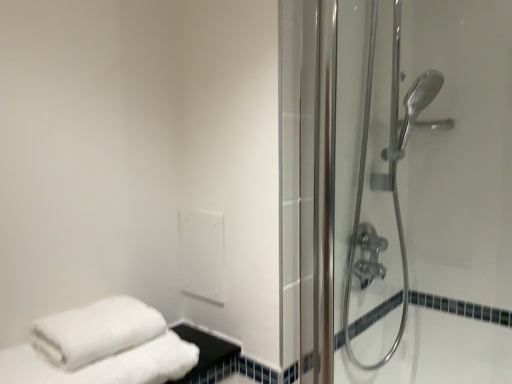
What is the approximate width of polished chrome shower door at right, positioned as the second shower door in front-to-back order?

polished chrome shower door at right, positioned as the second shower door in front-to-back order, is 7.15 inches in width.

You are a GUI agent. You are given a task and a screenshot of the screen. Output one action in this format:
    pyautogui.click(x=<x>, y=<y>)
    Task: Click on the polished chrome shower door at right, which is counted as the 1th shower door, starting from the back
    This screenshot has width=512, height=384.
    Given the screenshot: What is the action you would take?
    pyautogui.click(x=360, y=213)

This screenshot has height=384, width=512. Describe the element at coordinates (360, 213) in the screenshot. I see `polished chrome shower door at right, positioned as the second shower door in front-to-back order` at that location.

In order to face polished chrome shower door at right, positioned as the second shower door in front-to-back order, should I rotate leftwards or rightwards?

Turn right approximately 18.663 degrees to face it.

This screenshot has height=384, width=512. What are the coordinates of `transparent glass shower door at right, positioned as the 1th shower door in front-to-back order` in the screenshot? It's located at (425, 185).

Describe the element at coordinates (425, 185) in the screenshot. This screenshot has width=512, height=384. I see `transparent glass shower door at right, the 2th shower door in the back-to-front sequence` at that location.

Image resolution: width=512 pixels, height=384 pixels. I want to click on polished chrome shower door at right, which is counted as the 1th shower door, starting from the back, so click(360, 213).

Based on their positions, is transparent glass shower door at right, the 2th shower door in the back-to-front sequence, located to the left or right of polished chrome shower door at right, positioned as the second shower door in front-to-back order?

In the image, transparent glass shower door at right, the 2th shower door in the back-to-front sequence, appears on the left side of polished chrome shower door at right, positioned as the second shower door in front-to-back order.

Is transparent glass shower door at right, positioned as the 1th shower door in front-to-back order, further to camera compared to polished chrome shower door at right, which is counted as the 1th shower door, starting from the back?

No, it is in front of polished chrome shower door at right, which is counted as the 1th shower door, starting from the back.

Considering the points (493, 315) and (399, 35), which point is in front, point (493, 315) or point (399, 35)?

Positioned in front is point (493, 315).

From the image's perspective, is transparent glass shower door at right, positioned as the 1th shower door in front-to-back order, below polished chrome shower door at right, positioned as the second shower door in front-to-back order?

Correct, transparent glass shower door at right, positioned as the 1th shower door in front-to-back order, appears lower than polished chrome shower door at right, positioned as the second shower door in front-to-back order, in the image.

From a real-world perspective, is transparent glass shower door at right, the 2th shower door in the back-to-front sequence, positioned under polished chrome shower door at right, positioned as the second shower door in front-to-back order, based on gravity?

Indeed, from a real-world perspective, transparent glass shower door at right, the 2th shower door in the back-to-front sequence, is positioned beneath polished chrome shower door at right, positioned as the second shower door in front-to-back order.

Which object is thinner, transparent glass shower door at right, the 2th shower door in the back-to-front sequence, or polished chrome shower door at right, which is counted as the 1th shower door, starting from the back?

Thinner between the two is transparent glass shower door at right, the 2th shower door in the back-to-front sequence.

Considering the relative sizes of transparent glass shower door at right, the 2th shower door in the back-to-front sequence, and polished chrome shower door at right, positioned as the second shower door in front-to-back order, in the image provided, is transparent glass shower door at right, the 2th shower door in the back-to-front sequence, taller than polished chrome shower door at right, positioned as the second shower door in front-to-back order,?

No.

Looking at the image, does transparent glass shower door at right, positioned as the 1th shower door in front-to-back order, seem bigger or smaller compared to polished chrome shower door at right, which is counted as the 1th shower door, starting from the back?

transparent glass shower door at right, positioned as the 1th shower door in front-to-back order, is smaller than polished chrome shower door at right, which is counted as the 1th shower door, starting from the back.

Choose the correct answer: Is transparent glass shower door at right, the 2th shower door in the back-to-front sequence, inside polished chrome shower door at right, positioned as the second shower door in front-to-back order, or outside it?

transparent glass shower door at right, the 2th shower door in the back-to-front sequence, is located beyond the bounds of polished chrome shower door at right, positioned as the second shower door in front-to-back order.

Are transparent glass shower door at right, the 2th shower door in the back-to-front sequence, and polished chrome shower door at right, which is counted as the 1th shower door, starting from the back, located far from each other?

No, transparent glass shower door at right, the 2th shower door in the back-to-front sequence, is not far from polished chrome shower door at right, which is counted as the 1th shower door, starting from the back.

Is polished chrome shower door at right, which is counted as the 1th shower door, starting from the back, at the back of transparent glass shower door at right, the 2th shower door in the back-to-front sequence?

That's right, transparent glass shower door at right, the 2th shower door in the back-to-front sequence, is facing away from polished chrome shower door at right, which is counted as the 1th shower door, starting from the back.

Find the location of a particular element. Image resolution: width=512 pixels, height=384 pixels. shower door above the transparent glass shower door at right, the 2th shower door in the back-to-front sequence (from a real-world perspective) is located at coordinates (360, 213).

Which is more to the left, polished chrome shower door at right, which is counted as the 1th shower door, starting from the back, or transparent glass shower door at right, the 2th shower door in the back-to-front sequence?

From the viewer's perspective, transparent glass shower door at right, the 2th shower door in the back-to-front sequence, appears more on the left side.

Considering the positions of objects polished chrome shower door at right, which is counted as the 1th shower door, starting from the back, and transparent glass shower door at right, positioned as the 1th shower door in front-to-back order, in the image provided, who is behind, polished chrome shower door at right, which is counted as the 1th shower door, starting from the back, or transparent glass shower door at right, positioned as the 1th shower door in front-to-back order,?

polished chrome shower door at right, which is counted as the 1th shower door, starting from the back, is further away from the camera.

Which is more distant, (352, 355) or (508, 172)?

The point (352, 355) is farther from the camera.

From the image's perspective, is polished chrome shower door at right, positioned as the second shower door in front-to-back order, on transparent glass shower door at right, positioned as the 1th shower door in front-to-back order?

Yes, from the image's perspective, polished chrome shower door at right, positioned as the second shower door in front-to-back order, is on top of transparent glass shower door at right, positioned as the 1th shower door in front-to-back order.

From a real-world perspective, is polished chrome shower door at right, positioned as the second shower door in front-to-back order, over transparent glass shower door at right, the 2th shower door in the back-to-front sequence?

Yes.

Considering the relative sizes of polished chrome shower door at right, positioned as the second shower door in front-to-back order, and transparent glass shower door at right, the 2th shower door in the back-to-front sequence, in the image provided, is polished chrome shower door at right, positioned as the second shower door in front-to-back order, wider than transparent glass shower door at right, the 2th shower door in the back-to-front sequence,?

Yes.

Between polished chrome shower door at right, positioned as the second shower door in front-to-back order, and transparent glass shower door at right, the 2th shower door in the back-to-front sequence, which one has more height?

Standing taller between the two is polished chrome shower door at right, positioned as the second shower door in front-to-back order.

Between polished chrome shower door at right, positioned as the second shower door in front-to-back order, and transparent glass shower door at right, positioned as the 1th shower door in front-to-back order, which one has larger size?

polished chrome shower door at right, positioned as the second shower door in front-to-back order.

Is polished chrome shower door at right, positioned as the second shower door in front-to-back order, surrounding transparent glass shower door at right, the 2th shower door in the back-to-front sequence?

Definitely not — transparent glass shower door at right, the 2th shower door in the back-to-front sequence, is not inside polished chrome shower door at right, positioned as the second shower door in front-to-back order.

Is polished chrome shower door at right, which is counted as the 1th shower door, starting from the back, touching transparent glass shower door at right, positioned as the 1th shower door in front-to-back order?

No, polished chrome shower door at right, which is counted as the 1th shower door, starting from the back, is not with transparent glass shower door at right, positioned as the 1th shower door in front-to-back order.

Is polished chrome shower door at right, positioned as the second shower door in front-to-back order, facing towards transparent glass shower door at right, positioned as the 1th shower door in front-to-back order?

No, polished chrome shower door at right, positioned as the second shower door in front-to-back order, is not facing towards transparent glass shower door at right, positioned as the 1th shower door in front-to-back order.

The height and width of the screenshot is (384, 512). In order to click on shower door on the right of transparent glass shower door at right, positioned as the 1th shower door in front-to-back order in this screenshot , I will do `click(360, 213)`.

Image resolution: width=512 pixels, height=384 pixels. I want to click on shower door behind the transparent glass shower door at right, positioned as the 1th shower door in front-to-back order, so click(x=360, y=213).

I want to click on shower door on the left side of polished chrome shower door at right, which is counted as the 1th shower door, starting from the back, so click(x=425, y=185).